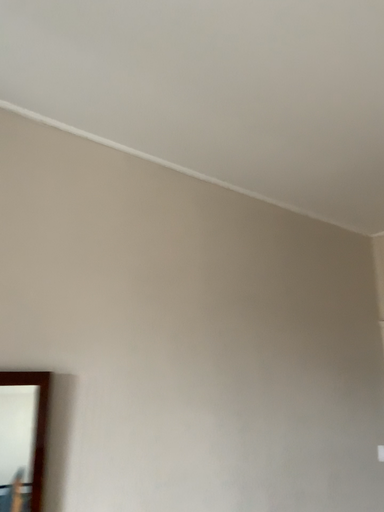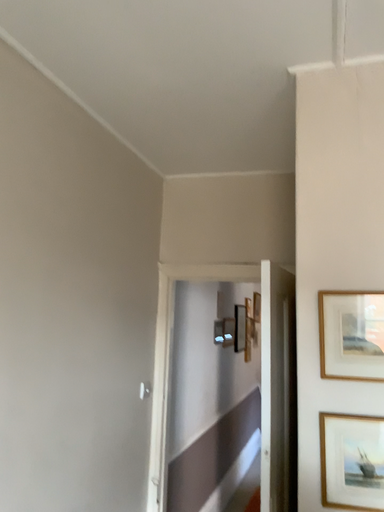
Question: Which way did the camera rotate in the video?

Choices:
 (A) rotated right
 (B) rotated left

Answer: (A)